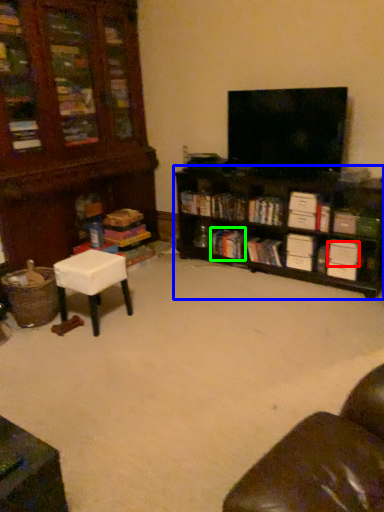
Question: Which object is the closest to the drawer (highlighted by a red box)? Choose among these: shelf (highlighted by a blue box) or book (highlighted by a green box).

Choices:
 (A) shelf
 (B) book

Answer: (A)